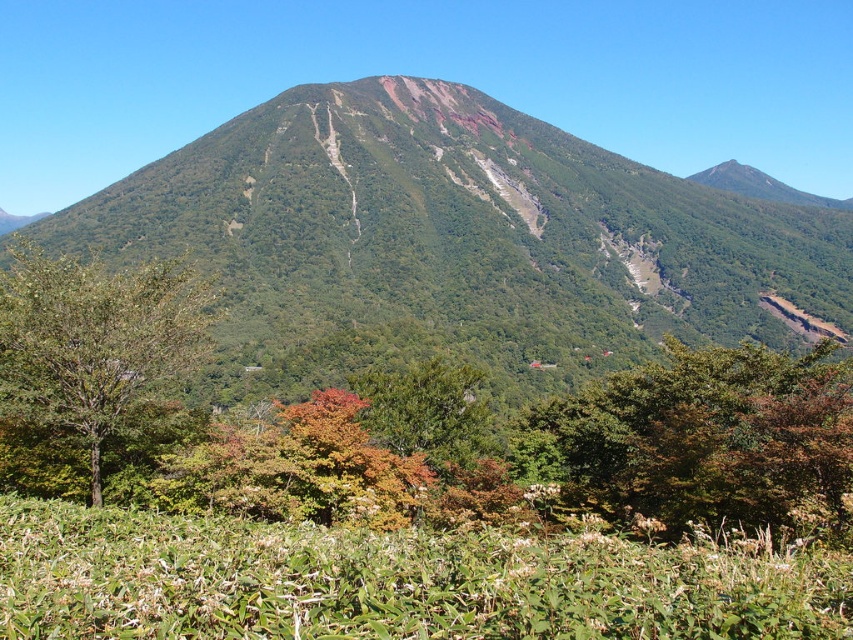
Question: Which point appears farthest from the camera in this image?

Choices:
 (A) (821, 353)
 (B) (93, 289)
 (C) (477, 387)

Answer: (C)

Question: Can you confirm if green leafy tree at center is positioned to the left of green matte tree at center?

Choices:
 (A) no
 (B) yes

Answer: (A)

Question: Estimate the real-world distances between objects in this image. Which object is farther from the green matte tree at lower left?

Choices:
 (A) green leafy tree at center
 (B) green textured mountain at center
 (C) green matte tree at center

Answer: (B)

Question: Estimate the real-world distances between objects in this image. Which object is farther from the green textured mountain at center?

Choices:
 (A) green matte tree at center
 (B) green matte tree at lower left

Answer: (A)

Question: Is green textured mountain at center to the left of green matte tree at lower left from the viewer's perspective?

Choices:
 (A) yes
 (B) no

Answer: (B)

Question: Does green matte tree at lower left come behind green matte tree at center?

Choices:
 (A) yes
 (B) no

Answer: (B)